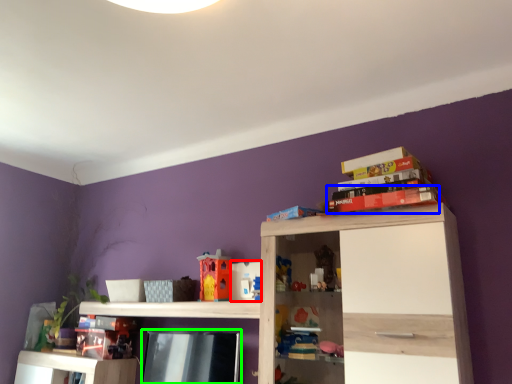
Question: Which object is the closest to the toy (highlighted by a red box)? Choose among these: book (highlighted by a blue box) or book (highlighted by a green box).

Choices:
 (A) book
 (B) book

Answer: (B)